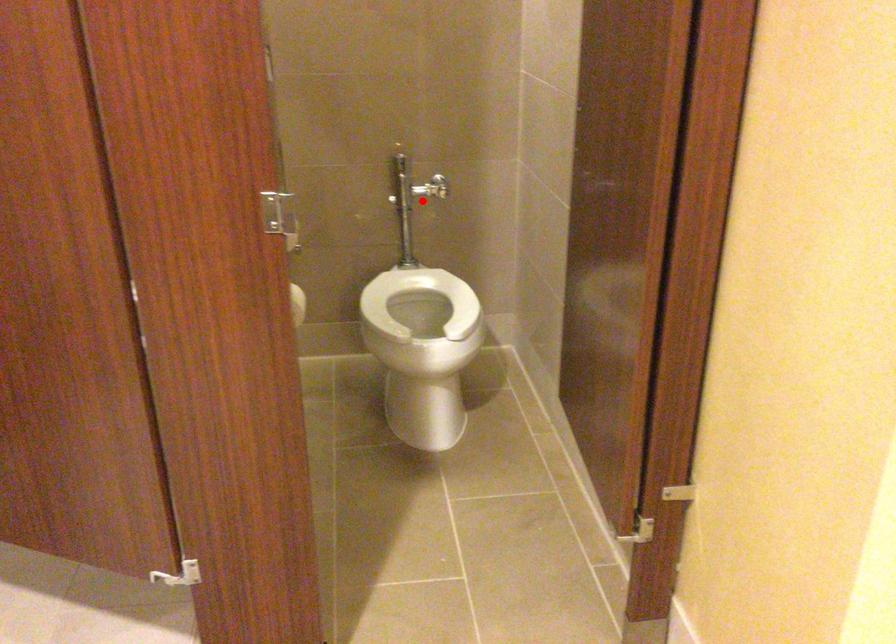
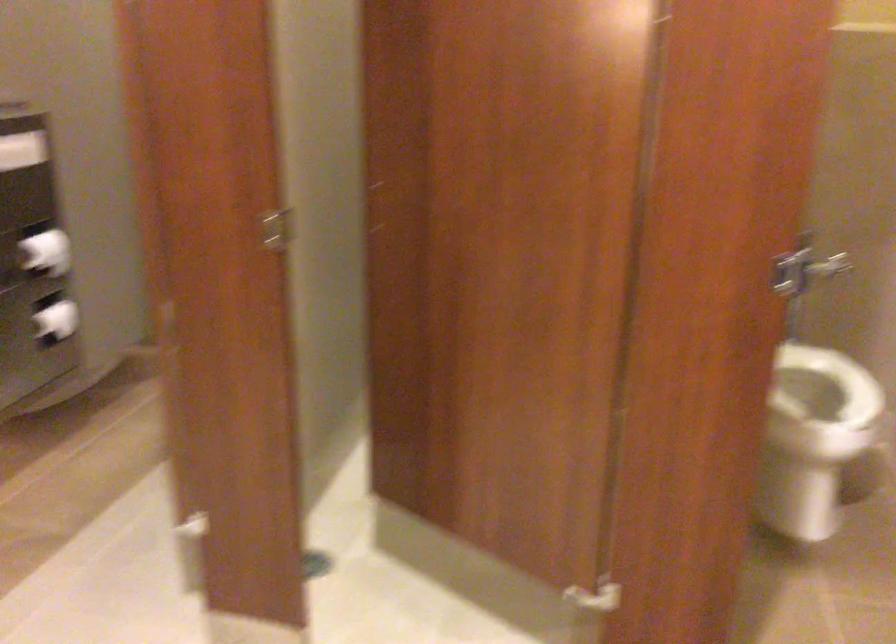
Where in the second image is the point corresponding to the highlighted location from the first image?

(830, 266)